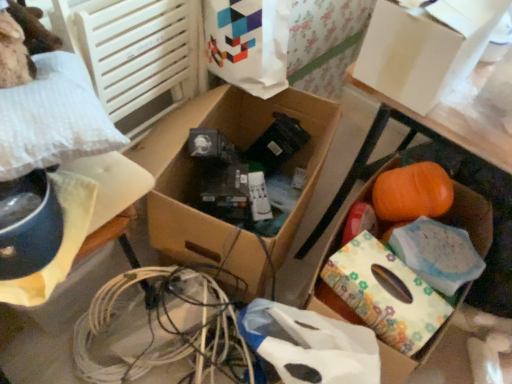
Question: Is white paper bag at upper center at the back of white cardboard box at upper right, which appears as the 3th storage box when viewed from the left?

Choices:
 (A) no
 (B) yes

Answer: (A)

Question: From a real-world perspective, is white cardboard box at upper right, which appears as the 3th storage box when viewed from the left, below white paper bag at upper center?

Choices:
 (A) no
 (B) yes

Answer: (A)

Question: Does white cardboard box at upper right, which appears as the 3th storage box when viewed from the left, have a larger size compared to white paper bag at upper center?

Choices:
 (A) yes
 (B) no

Answer: (B)

Question: Is white cardboard box at upper right, the 2th storage box viewed from the right, further to the viewer compared to white paper bag at upper center?

Choices:
 (A) yes
 (B) no

Answer: (B)

Question: Is white paper bag at upper center surrounded by white cardboard box at upper right, which appears as the 3th storage box when viewed from the left?

Choices:
 (A) yes
 (B) no

Answer: (B)

Question: Based on their positions, is white paper bag at upper center located to the left or right of white plastic bag at left, the first storage box when ordered from left to right?

Choices:
 (A) left
 (B) right

Answer: (B)

Question: Looking at their shapes, would you say white paper bag at upper center is wider or thinner than white plastic bag at left, the first storage box when ordered from left to right?

Choices:
 (A) wide
 (B) thin

Answer: (B)

Question: From a real-world perspective, is white paper bag at upper center physically located above or below white plastic bag at left, the fourth storage box viewed from the right?

Choices:
 (A) below
 (B) above

Answer: (B)

Question: From the image's perspective, relative to white plastic bag at left, the fourth storage box viewed from the right, is white paper bag at upper center above or below?

Choices:
 (A) above
 (B) below

Answer: (A)

Question: From the image's perspective, is white plastic bag at left, the first storage box when ordered from left to right, positioned above or below floral-patterned paper at lower right?

Choices:
 (A) below
 (B) above

Answer: (B)

Question: Considering the positions of white plastic bag at left, the first storage box when ordered from left to right, and floral-patterned paper at lower right in the image, is white plastic bag at left, the first storage box when ordered from left to right, wider or thinner than floral-patterned paper at lower right?

Choices:
 (A) thin
 (B) wide

Answer: (B)

Question: In terms of height, does white plastic bag at left, the fourth storage box viewed from the right, look taller or shorter compared to floral-patterned paper at lower right?

Choices:
 (A) short
 (B) tall

Answer: (A)

Question: From a real-world perspective, is white plastic bag at left, the fourth storage box viewed from the right, physically located above or below floral-patterned paper at lower right?

Choices:
 (A) above
 (B) below

Answer: (A)

Question: Is white plastic bag at left, the fourth storage box viewed from the right, situated inside cardboard box at center, positioned as the 3th storage box in right-to-left order, or outside?

Choices:
 (A) inside
 (B) outside

Answer: (B)

Question: From a real-world perspective, is white plastic bag at left, the fourth storage box viewed from the right, positioned above or below cardboard box at center, positioned as the 3th storage box in right-to-left order?

Choices:
 (A) above
 (B) below

Answer: (A)